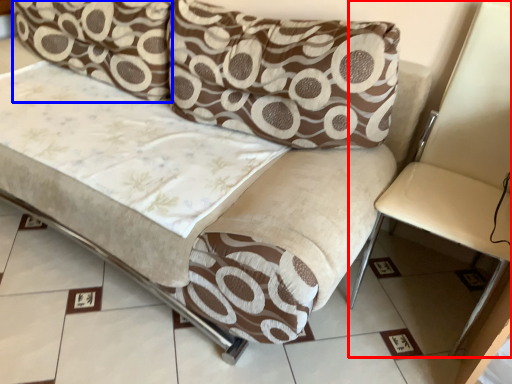
Question: Which object is further to the camera taking this photo, armchair (highlighted by a red box) or pillow (highlighted by a blue box)?

Choices:
 (A) armchair
 (B) pillow

Answer: (B)